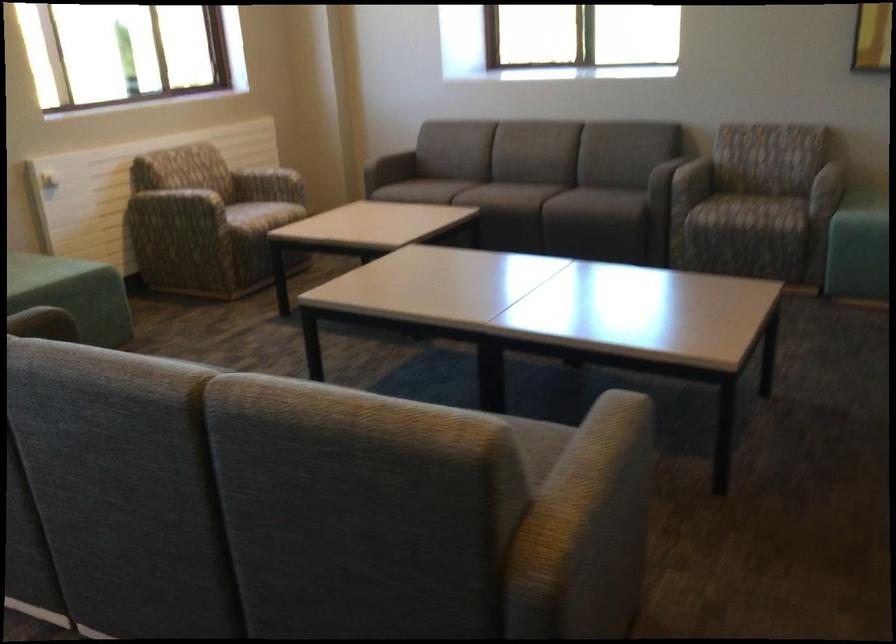
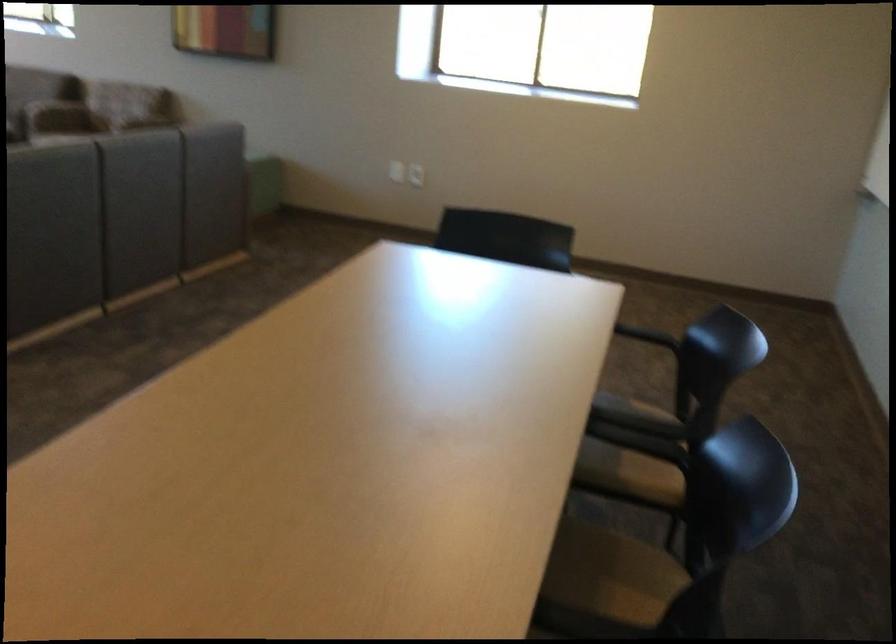
The images are taken continuously from a first-person perspective. In which direction are you moving?

The cameraman moved toward right, backward.